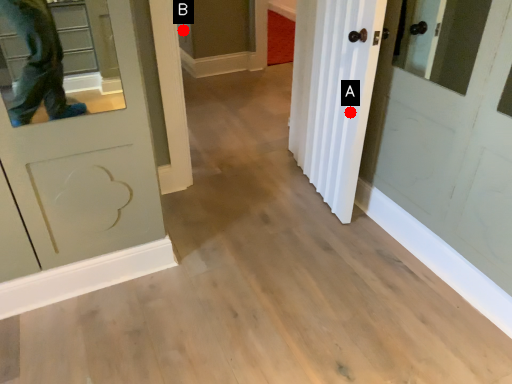
Question: Two points are circled on the image, labeled by A and B beside each circle. Which point is closer to the camera taking this photo?

Choices:
 (A) A is closer
 (B) B is closer

Answer: (A)